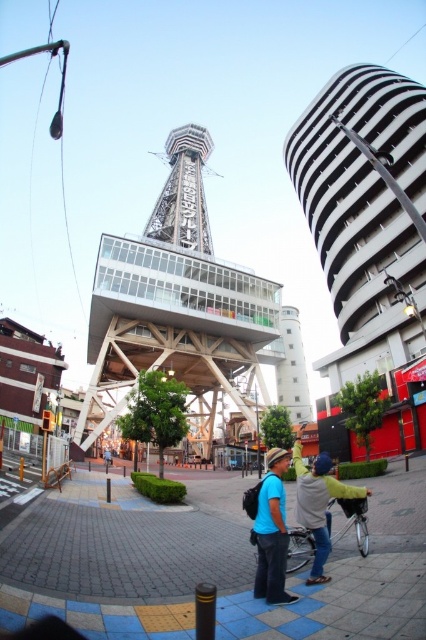
Does silver metallic bicycle at center have a smaller size compared to blue matte bicycle at center?

No, silver metallic bicycle at center is not smaller than blue matte bicycle at center.

This screenshot has width=426, height=640. Describe the element at coordinates (351, 522) in the screenshot. I see `silver metallic bicycle at center` at that location.

In order to click on silver metallic bicycle at center in this screenshot , I will do `click(351, 522)`.

Between black striped tower at upper right and blue fabric backpack at center, which one appears on the left side from the viewer's perspective?

blue fabric backpack at center is more to the left.

Can you confirm if black striped tower at upper right is wider than blue fabric backpack at center?

Indeed, black striped tower at upper right has a greater width compared to blue fabric backpack at center.

Does point (337, 161) come in front of point (267, 528)?

No, it is behind (267, 528).

I want to click on black striped tower at upper right, so click(x=362, y=188).

Does black striped tower at upper right have a greater height compared to metallic silver tower at center?

Yes.

Is black striped tower at upper right to the right of metallic silver tower at center from the viewer's perspective?

Yes, black striped tower at upper right is to the right of metallic silver tower at center.

Where is `black striped tower at upper right`? This screenshot has width=426, height=640. black striped tower at upper right is located at coordinates (362, 188).

Locate an element on the screen. This screenshot has width=426, height=640. black striped tower at upper right is located at coordinates (362, 188).